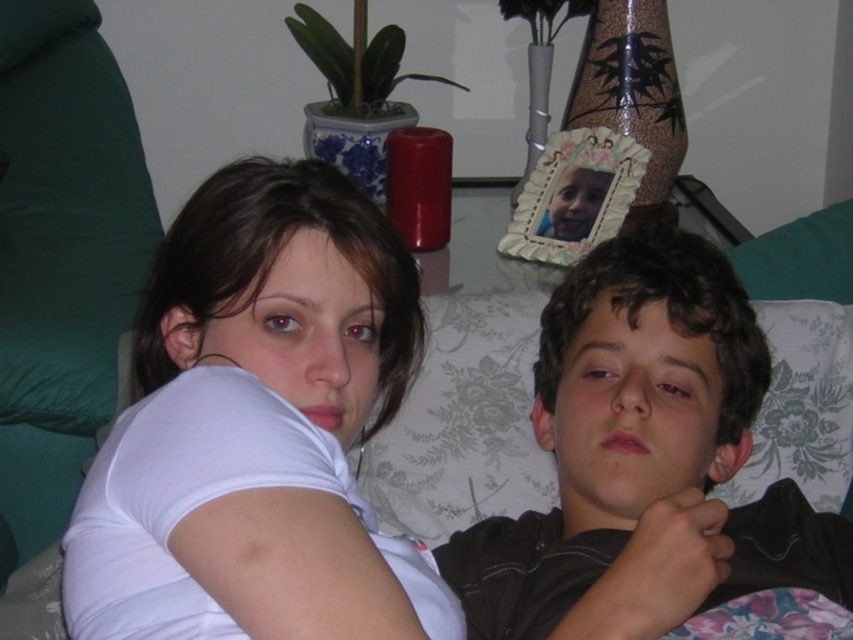
Who is more distant from viewer, (160, 356) or (722, 428)?

Positioned behind is point (722, 428).

Based on the photo, can you confirm if white matte shirt at upper left is positioned above dark brown curly hair at center?

Indeed, white matte shirt at upper left is positioned over dark brown curly hair at center.

Between point (142, 474) and point (820, 518), which one is positioned behind?

Positioned behind is point (820, 518).

Image resolution: width=853 pixels, height=640 pixels. In order to click on white matte shirt at upper left in this screenshot , I will do `click(256, 428)`.